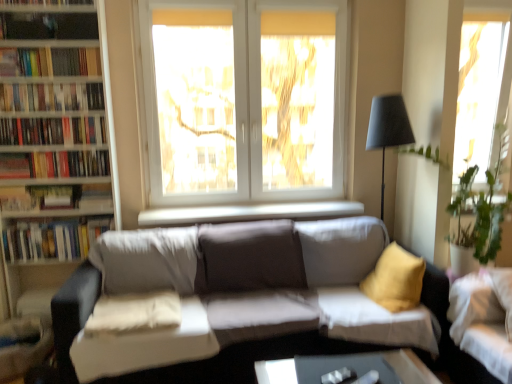
Question: From a real-world perspective, is white soft pillow at center physically located above or below white fabric couch at lower right, placed as the second studio couch when sorted from left to right?

Choices:
 (A) below
 (B) above

Answer: (A)

Question: Is point (168, 324) positioned closer to the camera than point (454, 283)?

Choices:
 (A) farther
 (B) closer

Answer: (B)

Question: Considering the real-world distances, which object is closest to the white smooth window sill at center?

Choices:
 (A) hardcover books at left, marked as the 3th book in a top-to-bottom arrangement
 (B) hardcover books at upper left, the fifth book from the bottom
 (C) white glass window at center, marked as the 1th window in a left-to-right arrangement
 (D) white wooden bookcase at left
 (E) light gray fabric couch at center, which appears as the 1th studio couch when viewed from the left

Answer: (E)

Question: Which object is positioned closest to the hardcover books at left, the 4th book positioned from the bottom?

Choices:
 (A) white fabric couch at lower right, placed as the second studio couch when sorted from left to right
 (B) hardcover books at left, the 3th book when ordered from bottom to top
 (C) white wooden bookcase at left
 (D) hardcover books at upper left, the 1th book positioned from the top
 (E) light gray fabric couch at center, which is counted as the second studio couch, starting from the right

Answer: (B)